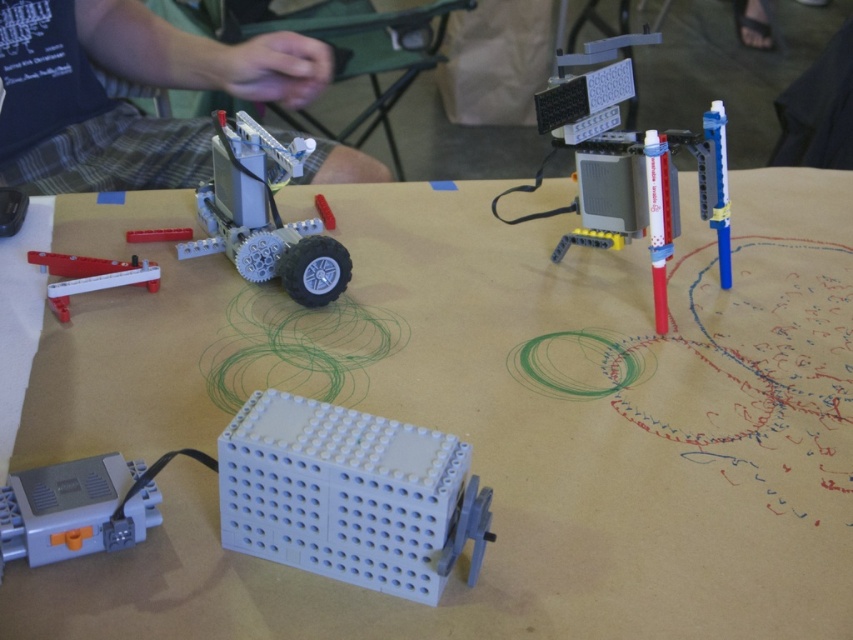
You are an engineer designing a new toy. You need to know which part is taller between the light blue plastic at center and the white plastic lever at left. Which one is taller?

The light blue plastic at center is taller than the white plastic lever at left according to the description.

You are an artist holding a translucent red pen at upper right and want to draw on the white plastic table at center. Can you reach the table from your current position without moving your hand?

The white plastic table at center is to the left of the translucent red pen at upper right, so yes, you can reach the table by extending your hand to the left since it is positioned adjacent to the pen.